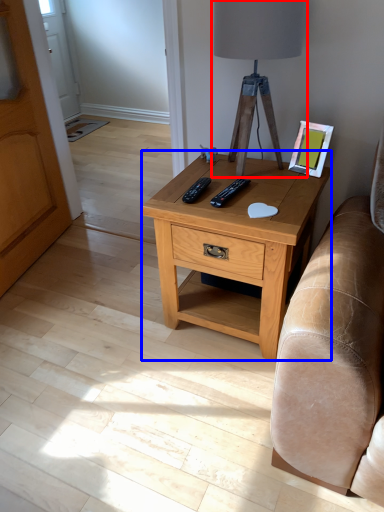
Question: Among these objects, which one is farthest to the camera, table lamp (highlighted by a red box) or nightstand (highlighted by a blue box)?

Choices:
 (A) table lamp
 (B) nightstand

Answer: (B)